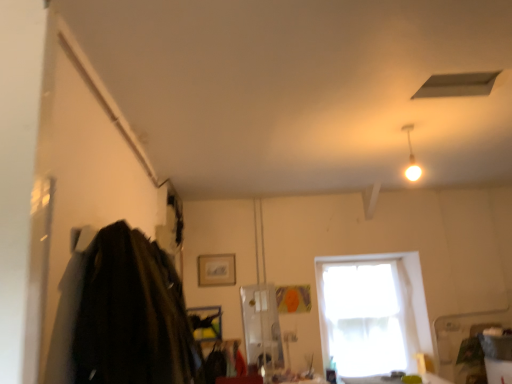
Question: Considering their positions, is white glossy light fixture at upper right located in front of or behind dark wool coat at left?

Choices:
 (A) behind
 (B) front

Answer: (A)

Question: Is white glossy light fixture at upper right taller or shorter than dark wool coat at left?

Choices:
 (A) short
 (B) tall

Answer: (A)

Question: Which object is positioned closest to the matte white exhaust hood at upper center?

Choices:
 (A) dark wool coat at left
 (B) white sheer curtain at center
 (C) white glossy light fixture at upper right

Answer: (C)

Question: Estimate the real-world distances between objects in this image. Which object is closer to the white glossy light fixture at upper right?

Choices:
 (A) matte white exhaust hood at upper center
 (B) white sheer curtain at center
 (C) dark wool coat at left

Answer: (A)